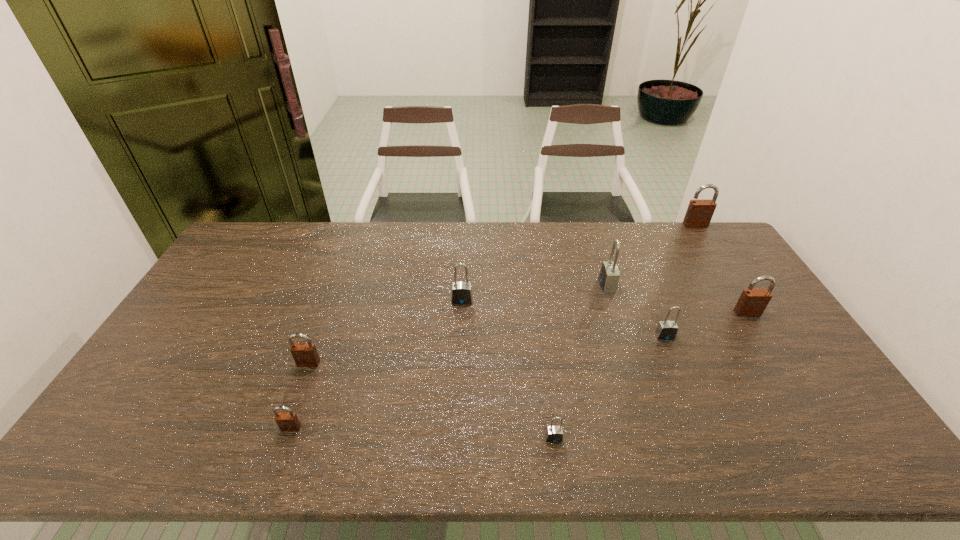
At what (x,y) coordinates should I click in order to perform the action: click on free point between the farthest padlock and the fourth nearest object. Please return your answer as a coordinate pair (x, y). The width and height of the screenshot is (960, 540). Looking at the image, I should click on (680, 280).

You are a GUI agent. You are given a task and a screenshot of the screen. Output one action in this format:
    pyautogui.click(x=<x>, y=<y>)
    Task: Click on the free space between the farthest object and the third farthest padlock
    
    Given the screenshot: What is the action you would take?
    pyautogui.click(x=579, y=262)

Find the location of a particular element. vacant space that's between the third nearest padlock and the farthest object is located at coordinates (502, 294).

At what (x,y) coordinates should I click in order to perform the action: click on free space between the third object from right to left and the third smallest brown padlock. Please return your answer as a coordinate pair (x, y). The height and width of the screenshot is (540, 960). Looking at the image, I should click on (706, 325).

The image size is (960, 540). Find the location of `empty space between the fourth farthest padlock and the farthest gray padlock`. empty space between the fourth farthest padlock and the farthest gray padlock is located at coordinates (677, 299).

Locate an element on the screen. Image resolution: width=960 pixels, height=540 pixels. unoccupied position between the nearest object and the fifth nearest padlock is located at coordinates (650, 376).

The image size is (960, 540). What are the coordinates of `free space between the third smallest brown padlock and the fourth nearest padlock` in the screenshot? It's located at (706, 325).

Find the location of a particular element. vacant space in between the second nearest brown padlock and the third farthest object is located at coordinates (385, 332).

At what (x,y) coordinates should I click in order to perform the action: click on free space that is in between the second farthest object and the fifth nearest padlock. Please return your answer as a coordinate pair (x, y). The height and width of the screenshot is (540, 960). Looking at the image, I should click on (677, 299).

You are a GUI agent. You are given a task and a screenshot of the screen. Output one action in this format:
    pyautogui.click(x=<x>, y=<y>)
    Task: Click on the free spot between the fourth farthest object and the third gray padlock from left to right
    This screenshot has height=540, width=960.
    Given the screenshot: What is the action you would take?
    click(677, 299)